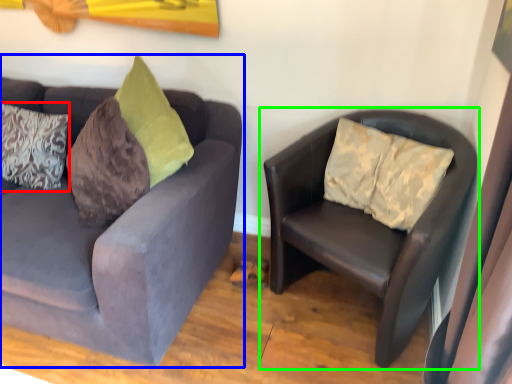
Question: Which object is positioned closest to pillow (highlighted by a red box)? Select from studio couch (highlighted by a blue box) and studio couch (highlighted by a green box).

Choices:
 (A) studio couch
 (B) studio couch

Answer: (A)